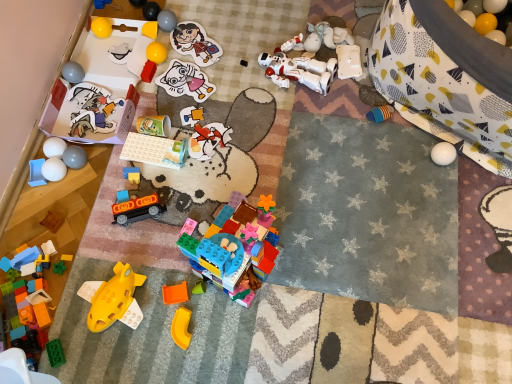
You are a GUI agent. You are given a task and a screenshot of the screen. Output one action in this format:
    pyautogui.click(x=<x>, y=<y>)
    Task: Click on the vacant area that lies between yellow matte plastic arch at center, which is the 5th toy in right-to-left order, and matte gray ball at upper center, which is the 18th toy in left-to-right order
    The image size is (512, 384).
    Given the screenshot: What is the action you would take?
    pyautogui.click(x=174, y=154)